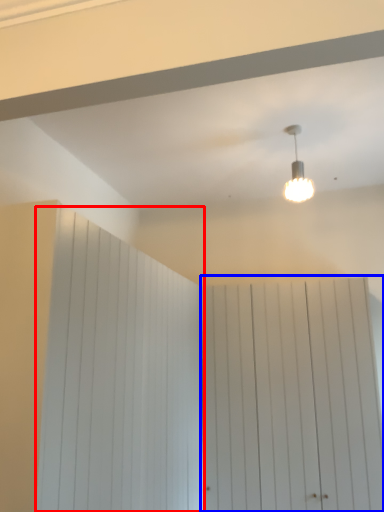
Question: Which point is further to the camera, barn door (highlighted by a red box) or barn door (highlighted by a blue box)?

Choices:
 (A) barn door
 (B) barn door

Answer: (B)